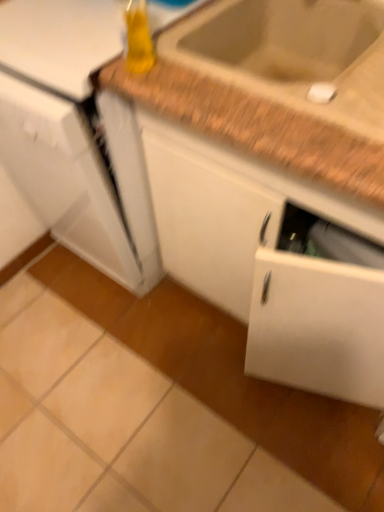
Image resolution: width=384 pixels, height=512 pixels. What are the coordinates of `free location in front of white glossy refrigerator at left` in the screenshot? It's located at (105, 369).